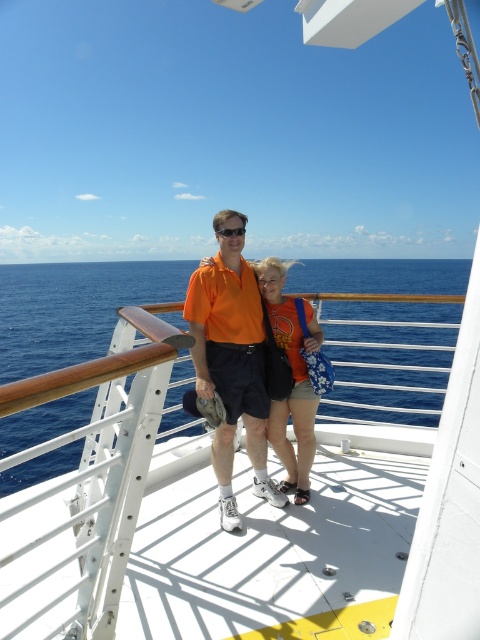
Question: Which object appears farthest from the camera in this image?

Choices:
 (A) orange matte shirt at center
 (B) orange cotton t-shirt at center

Answer: (B)

Question: Is orange matte shirt at center below black plastic goggles at center?

Choices:
 (A) no
 (B) yes

Answer: (B)

Question: Among these objects, which one is nearest to the camera?

Choices:
 (A) black plastic goggles at center
 (B) orange cotton t-shirt at center
 (C) orange matte shirt at center

Answer: (C)

Question: Can you confirm if orange matte shirt at center is thinner than black plastic goggles at center?

Choices:
 (A) yes
 (B) no

Answer: (B)

Question: Which object is closer to the camera taking this photo?

Choices:
 (A) black plastic goggles at center
 (B) orange matte shirt at center
 (C) orange cotton t-shirt at center

Answer: (B)

Question: Does orange matte shirt at center have a smaller size compared to black plastic goggles at center?

Choices:
 (A) no
 (B) yes

Answer: (A)